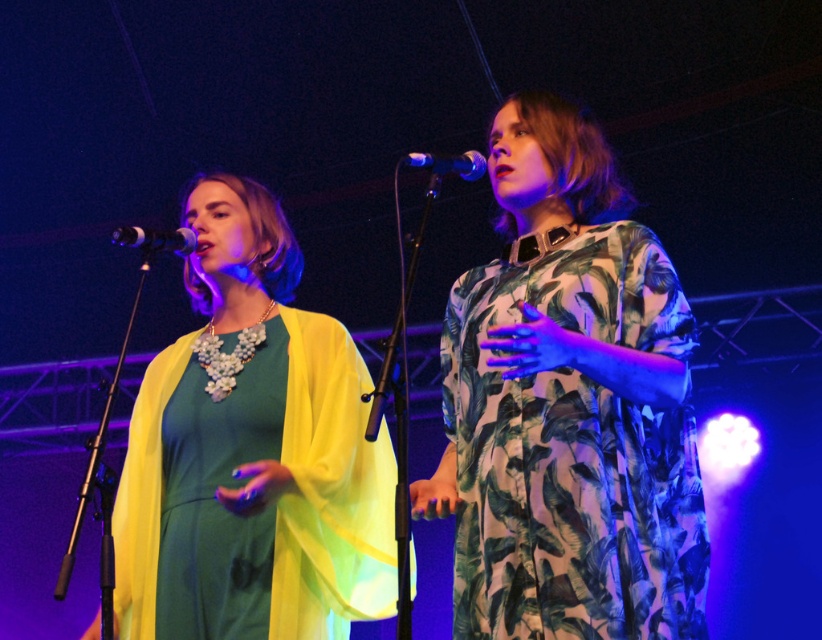
Question: Can you confirm if matte green dress at center is wider than green leafy fabric dress at center?

Choices:
 (A) yes
 (B) no

Answer: (A)

Question: Which of the following is the closest to the observer?

Choices:
 (A) (585, 614)
 (B) (308, 326)
 (C) (473, 173)

Answer: (A)

Question: Can you confirm if matte green dress at center is smaller than green leafy fabric dress at center?

Choices:
 (A) no
 (B) yes

Answer: (A)

Question: Which point appears farthest from the camera in this image?

Choices:
 (A) (119, 548)
 (B) (150, 240)

Answer: (A)

Question: Can you confirm if green leafy fabric dress at center is bigger than metallic silver microphone at left?

Choices:
 (A) yes
 (B) no

Answer: (A)

Question: Which is nearer to the green leafy fabric dress at center?

Choices:
 (A) matte green dress at center
 (B) metallic silver microphone at center

Answer: (A)